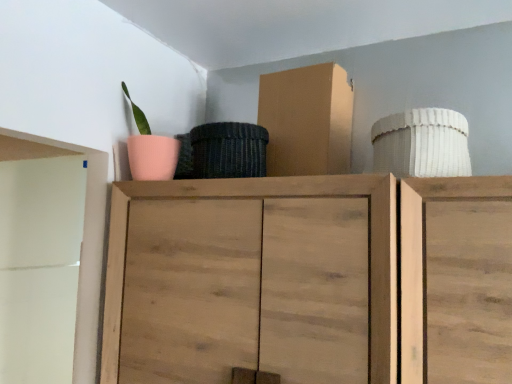
Question: Can you confirm if cardboard box at upper center is taller than wooden cabinet at center?

Choices:
 (A) no
 (B) yes

Answer: (A)

Question: Considering the relative sizes of cardboard box at upper center and wooden cabinet at center in the image provided, is cardboard box at upper center shorter than wooden cabinet at center?

Choices:
 (A) yes
 (B) no

Answer: (A)

Question: Is cardboard box at upper center with wooden cabinet at center?

Choices:
 (A) yes
 (B) no

Answer: (B)

Question: Is cardboard box at upper center closer to the viewer compared to wooden cabinet at center?

Choices:
 (A) no
 (B) yes

Answer: (A)

Question: Is cardboard box at upper center looking in the opposite direction of wooden cabinet at center?

Choices:
 (A) yes
 (B) no

Answer: (B)

Question: Is cardboard box at upper center wider than wooden cabinet at center?

Choices:
 (A) yes
 (B) no

Answer: (B)

Question: Can you confirm if wooden cabinet at center is positioned to the right of cardboard box at upper center?

Choices:
 (A) no
 (B) yes

Answer: (A)

Question: Can you confirm if wooden cabinet at center is wider than cardboard box at upper center?

Choices:
 (A) yes
 (B) no

Answer: (A)

Question: Considering the relative sizes of wooden cabinet at center and cardboard box at upper center in the image provided, is wooden cabinet at center shorter than cardboard box at upper center?

Choices:
 (A) yes
 (B) no

Answer: (B)

Question: From a real-world perspective, is wooden cabinet at center physically above cardboard box at upper center?

Choices:
 (A) yes
 (B) no

Answer: (B)

Question: Does wooden cabinet at center have a smaller size compared to cardboard box at upper center?

Choices:
 (A) yes
 (B) no

Answer: (B)

Question: Does wooden cabinet at center have a greater height compared to cardboard box at upper center?

Choices:
 (A) no
 (B) yes

Answer: (B)

Question: Looking at their shapes, would you say cardboard box at upper center is wider or thinner than wooden cabinet at center?

Choices:
 (A) wide
 (B) thin

Answer: (B)